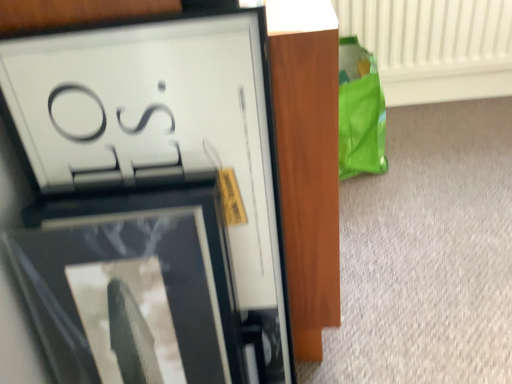
Question: Is matte black picture frame at upper left, the 2th picture frame ordered from the bottom, taller or shorter than matte black picture frame at upper left, the 1th picture frame when ordered from bottom to top?

Choices:
 (A) tall
 (B) short

Answer: (A)

Question: From a real-world perspective, is matte black picture frame at upper left, the 2th picture frame ordered from the bottom, physically located above or below matte black picture frame at upper left, the 1th picture frame when ordered from bottom to top?

Choices:
 (A) below
 (B) above

Answer: (B)

Question: Estimate the real-world distances between objects in this image. Which object is farther from the matte black picture frame at upper left, the 1th picture frame viewed from the top?

Choices:
 (A) white textured radiator at upper right
 (B) matte black picture frame at upper left, the 1th picture frame when ordered from bottom to top

Answer: (A)

Question: Based on their relative distances, which object is nearer to the matte black picture frame at upper left, the 2th picture frame when ordered from top to bottom?

Choices:
 (A) matte black picture frame at upper left, the 2th picture frame ordered from the bottom
 (B) white textured radiator at upper right

Answer: (A)